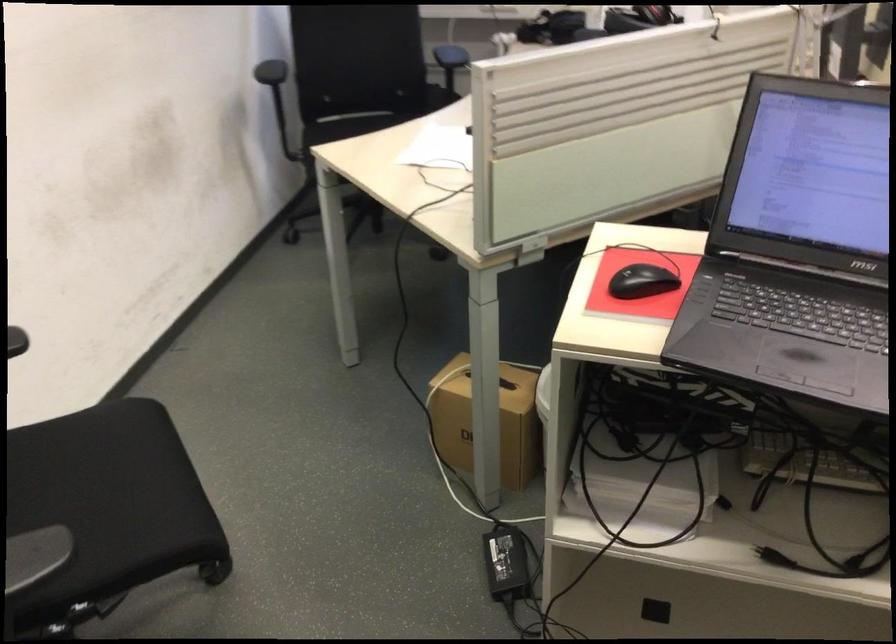
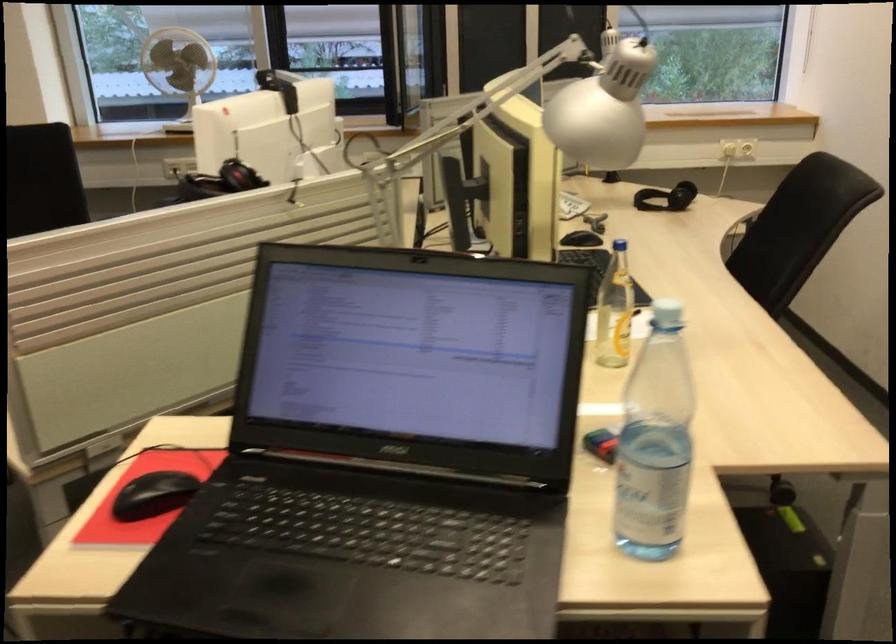
Question: The camera is either moving clockwise (left) or counter-clockwise (right) around the object. The first image is from the beginning of the video and the second image is from the end. Is the camera moving left or right when shooting the video?

Choices:
 (A) Left
 (B) Right

Answer: (A)